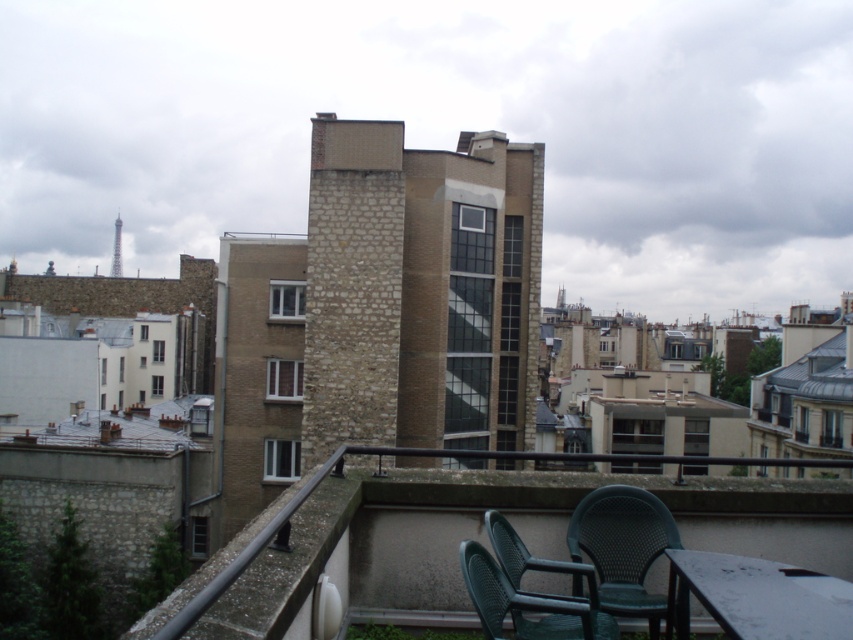
Question: Does green plastic chairs at lower right have a lesser width compared to brown stone chimney at center?

Choices:
 (A) yes
 (B) no

Answer: (B)

Question: Which object is positioned farthest from the brown stone chimney at center?

Choices:
 (A) green wicker chair at lower right
 (B) green mesh chair at lower center

Answer: (B)

Question: Which object appears farthest from the camera in this image?

Choices:
 (A) green mesh chair at lower center
 (B) brown stone chimney at center
 (C) green plastic chairs at lower right

Answer: (B)

Question: Is brown stone chimney at center closer to camera compared to green mesh chair at lower center?

Choices:
 (A) no
 (B) yes

Answer: (A)

Question: Which of the following is the closest to the observer?

Choices:
 (A) (488, 582)
 (B) (341, 138)

Answer: (A)

Question: Is white glossy table at lower right wider than green mesh chair at lower center?

Choices:
 (A) no
 (B) yes

Answer: (B)